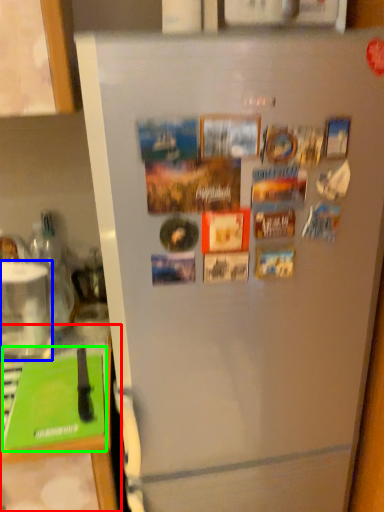
Question: Which is nearer to the counter top (highlighted by a red box)? appliance (highlighted by a blue box) or magazine (highlighted by a green box).

Choices:
 (A) appliance
 (B) magazine

Answer: (B)